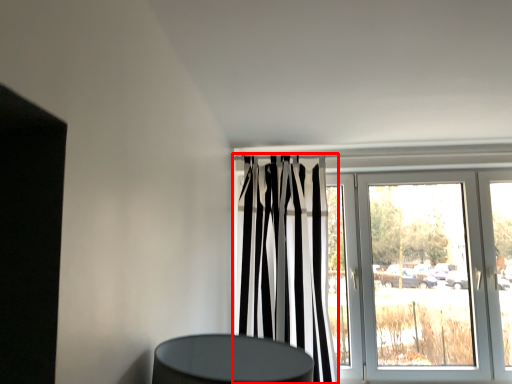
Question: In this image, where is curtain (annotated by the red box) located relative to door?

Choices:
 (A) right
 (B) left

Answer: (B)